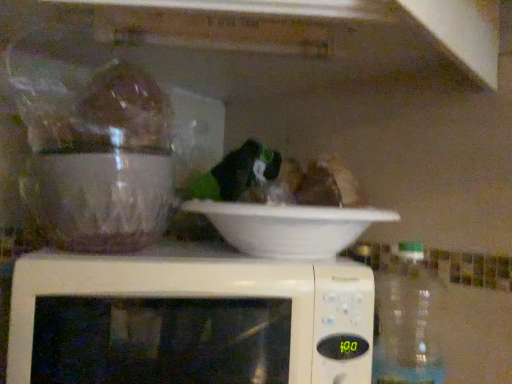
Question: Is point (346, 294) closer or farther from the camera than point (289, 238)?

Choices:
 (A) farther
 (B) closer

Answer: (B)

Question: Based on their sizes in the image, would you say white plastic microwave at center is bigger or smaller than white matte bowl at center?

Choices:
 (A) big
 (B) small

Answer: (A)

Question: Considering the real-world distances, which object is farthest from the transparent plastic bottle at right?

Choices:
 (A) white plastic microwave at center
 (B) white matte bowl at center

Answer: (A)

Question: Estimate the real-world distances between objects in this image. Which object is closer to the transparent plastic bottle at right?

Choices:
 (A) white plastic microwave at center
 (B) white matte bowl at center

Answer: (B)